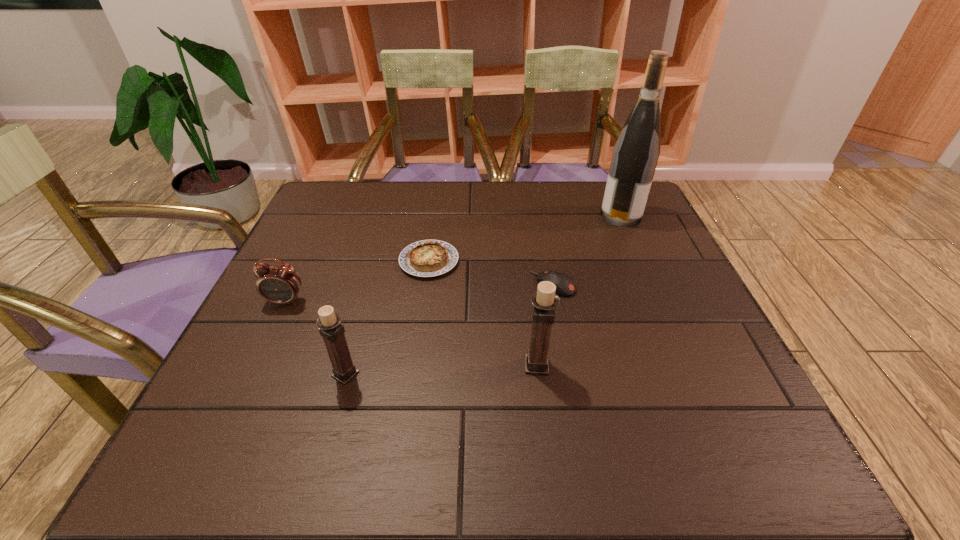
Find the location of a particular element. object at the far right corner is located at coordinates (636, 152).

Where is `free location at the far edge`? The image size is (960, 540). free location at the far edge is located at coordinates (535, 190).

In the image, there is a desktop. Find the location of `vacant space at the near edge`. vacant space at the near edge is located at coordinates (435, 397).

You are a GUI agent. You are given a task and a screenshot of the screen. Output one action in this format:
    pyautogui.click(x=<x>, y=<y>)
    Task: Click on the vacant region at the left edge of the desktop
    The image size is (960, 540).
    Given the screenshot: What is the action you would take?
    tap(281, 305)

At what (x,y) coordinates should I click in order to perform the action: click on vacant space at the right edge of the desktop. Please return your answer as a coordinate pair (x, y). Looking at the image, I should click on (660, 288).

I want to click on free space at the far left corner of the desktop, so click(x=369, y=196).

Image resolution: width=960 pixels, height=540 pixels. I want to click on blank space at the near left corner of the desktop, so click(266, 380).

Find the location of a particular element. free space at the near right corner is located at coordinates (728, 395).

Locate an element on the screen. The height and width of the screenshot is (540, 960). free spot between the quiche and the left candle holder is located at coordinates (387, 318).

Find the location of `free space between the wine bottle and the left candle holder`. free space between the wine bottle and the left candle holder is located at coordinates (483, 295).